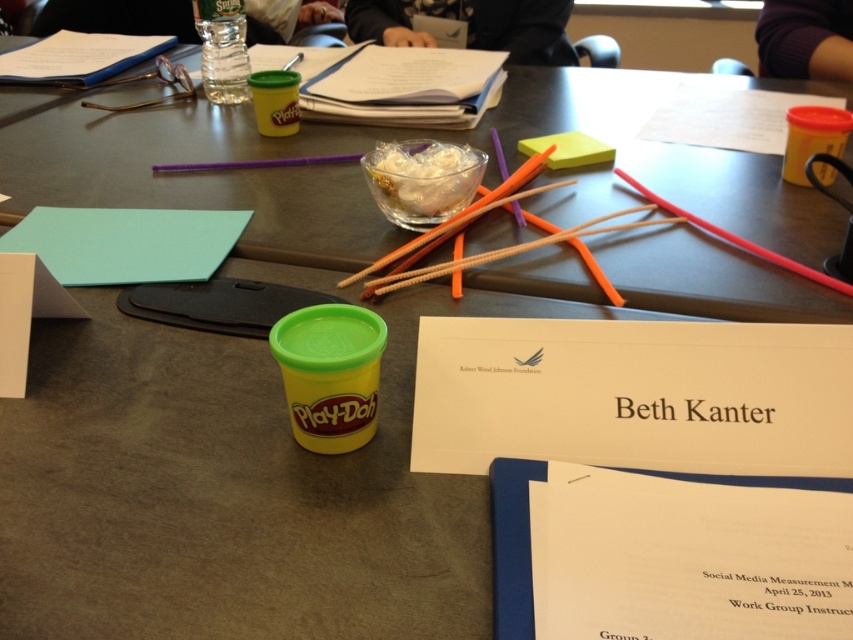
In the scene shown: You are organizing a workshop and need to place a yellow sticky note at upper center on the table. There is already a yellow matte paper cup at upper right. Can the sticky note fit next to the cup without overlapping?

The yellow matte paper cup at upper right is larger in size than the yellow sticky note at upper center, so there should be enough space to place the sticky note next to the cup without overlapping.

You are organizing a workshop and need to place a 10cm wide sticky note on the table. You have the teal matte notepad at upper left and the yellow matte paper cup at upper right. Which object can the sticky note fit on top of without overhanging?

The teal matte notepad at upper left is larger in size than the yellow matte paper cup at upper right, so the sticky note can fit on the teal matte notepad at upper left without overhanging.